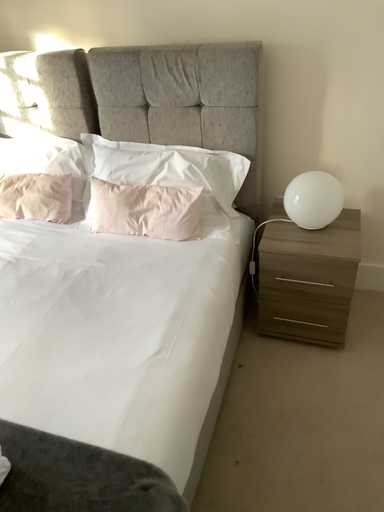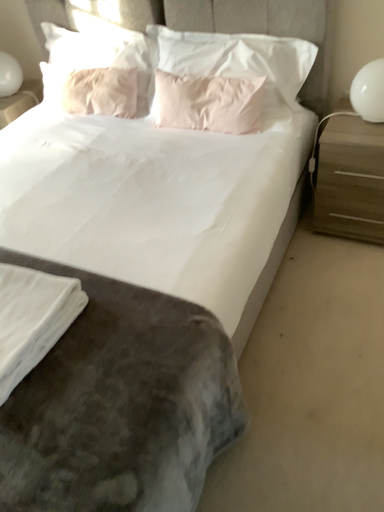
Question: Which way did the camera rotate in the video?

Choices:
 (A) rotated right
 (B) rotated left

Answer: (B)